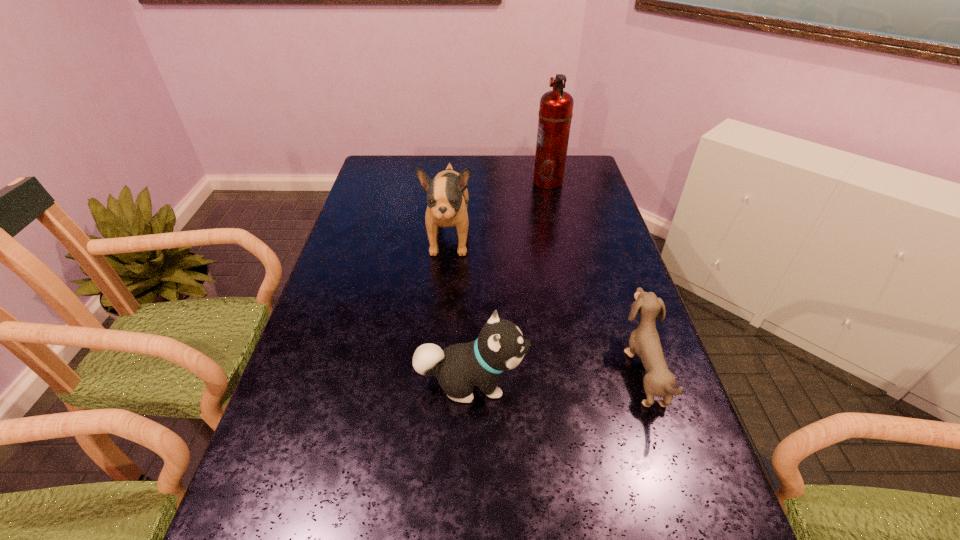
In the image, there is a desktop. At what (x,y) coordinates should I click in order to perform the action: click on vacant area at the left edge. Please return your answer as a coordinate pair (x, y). Looking at the image, I should click on (372, 194).

Identify the location of free point at the right edge. Image resolution: width=960 pixels, height=540 pixels. (688, 504).

Where is `blank area at the far right corner`? This screenshot has height=540, width=960. blank area at the far right corner is located at coordinates (575, 176).

Locate an element on the screen. vacant region between the farthest object and the third tallest object is located at coordinates (510, 282).

Identify the location of unoccupied position between the rightmost puppy and the third tallest object. (557, 376).

Find the location of a particular element. Image resolution: width=960 pixels, height=540 pixels. empty space that is in between the second tallest puppy and the shortest object is located at coordinates (557, 376).

At what (x,y) coordinates should I click in order to perform the action: click on free space between the shortest object and the second tallest puppy. Please return your answer as a coordinate pair (x, y). This screenshot has height=540, width=960. Looking at the image, I should click on (557, 376).

Locate an element on the screen. The width and height of the screenshot is (960, 540). vacant space in between the second object from right to left and the second shortest object is located at coordinates (510, 282).

The height and width of the screenshot is (540, 960). What are the coordinates of `free area in between the third tallest object and the tallest puppy` in the screenshot? It's located at (461, 309).

Find the location of a particular element. object that stands as the closest to the rightmost object is located at coordinates (500, 346).